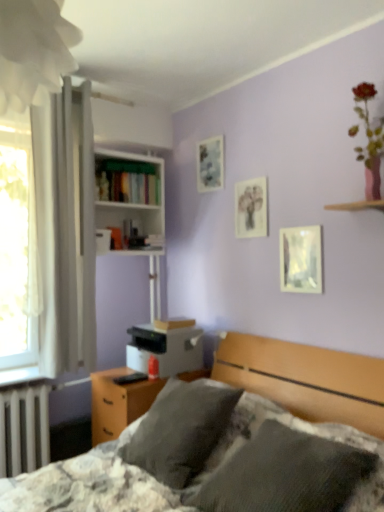
Question: Is white glossy bookcase at upper center in front of or behind hardcover books at center-left in the image?

Choices:
 (A) behind
 (B) front

Answer: (B)

Question: From a real-world perspective, is white glossy bookcase at upper center physically located above or below hardcover books at center-left?

Choices:
 (A) below
 (B) above

Answer: (A)

Question: Which is farther from the white glossy bookcase at upper center?

Choices:
 (A) textured gray pillows at center
 (B) matte glass picture frame at upper center, the third picture frame viewed from the front
 (C) metallic reflective picture frame at upper right, which ranks as the 1th picture frame in right-to-left order
 (D) white fabric curtain at left
 (E) gray soft pillow at center, positioned as the second pillow in front-to-back order

Answer: (E)

Question: Considering the real-world distances, which object is closest to the gray soft pillow at center, which is the first pillow in back-to-front order?

Choices:
 (A) hardcover books at center-left
 (B) textured gray pillows at center
 (C) metallic reflective picture frame at upper right, arranged as the 3th picture frame when viewed from the left
 (D) white fabric curtain at left
 (E) white fabric at upper left

Answer: (B)